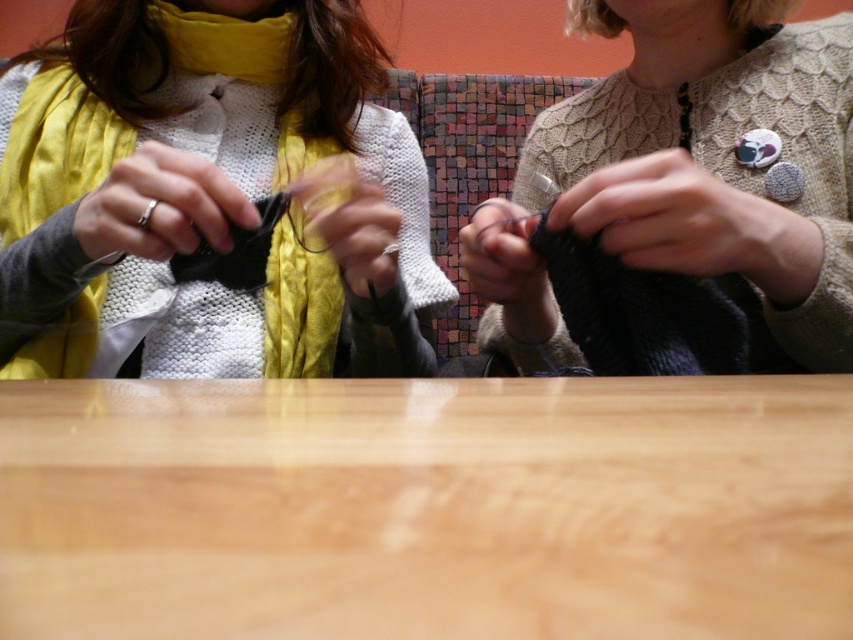
Question: Which point is closer to the camera?

Choices:
 (A) (170, 212)
 (B) (635, 161)
 (C) (519, 387)

Answer: (C)

Question: Which point is farther to the camera?

Choices:
 (A) (264, 547)
 (B) (480, 275)

Answer: (B)

Question: Can you confirm if matte black fabric at center is positioned to the right of matte black knitting needle at left?

Choices:
 (A) yes
 (B) no

Answer: (B)

Question: From the image, what is the correct spatial relationship of wooden table at center in relation to matte black fabric at center?

Choices:
 (A) below
 (B) above

Answer: (A)

Question: Is matte black fabric at center closer to the viewer compared to knitted beige sweater at center?

Choices:
 (A) yes
 (B) no

Answer: (B)

Question: Which point appears farthest from the camera in this image?

Choices:
 (A) (526, 340)
 (B) (3, 253)
 (C) (215, 577)
 (D) (820, 248)

Answer: (A)